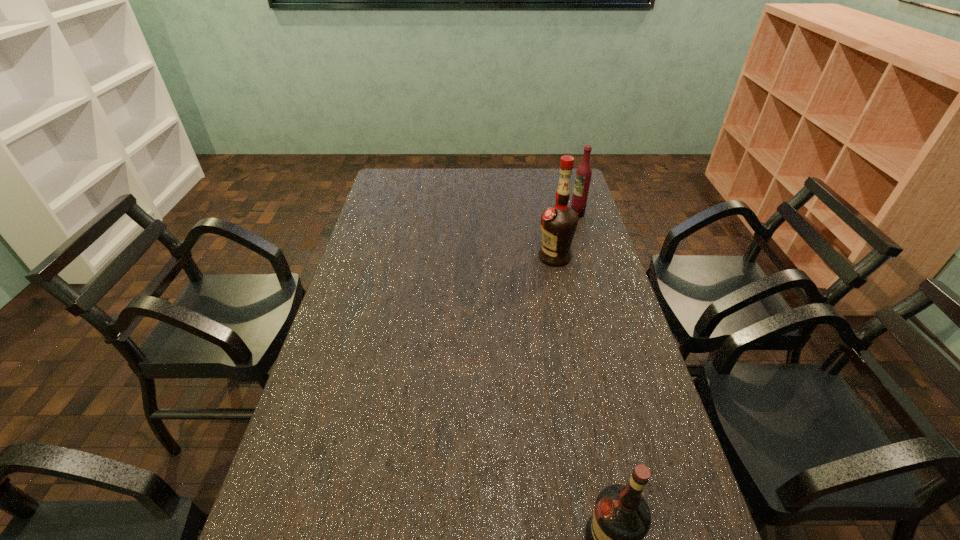
Where is `vacant region at the far edge of the desktop`? vacant region at the far edge of the desktop is located at coordinates (475, 170).

The height and width of the screenshot is (540, 960). In the image, there is a desktop. Identify the location of vacant space at the left edge. (376, 261).

Image resolution: width=960 pixels, height=540 pixels. I want to click on vacant space at the right edge of the desktop, so click(614, 306).

In the image, there is a desktop. Identify the location of vacant area at the far left corner. The height and width of the screenshot is (540, 960). (408, 168).

Image resolution: width=960 pixels, height=540 pixels. I want to click on object identified as the closest to the tallest object, so point(583,174).

Point out which object is positioned as the second nearest to the tallest object. Please provide its 2D coordinates. Your answer should be formatted as a tuple, i.e. [(x, y)], where the tuple contains the x and y coordinates of a point satisfying the conditions above.

[(621, 519)]

Find the location of `liquor that is the nearest to the nearest object`. liquor that is the nearest to the nearest object is located at coordinates (559, 222).

Where is `liquor that is the second closest to the farthest object`? The image size is (960, 540). liquor that is the second closest to the farthest object is located at coordinates (621, 519).